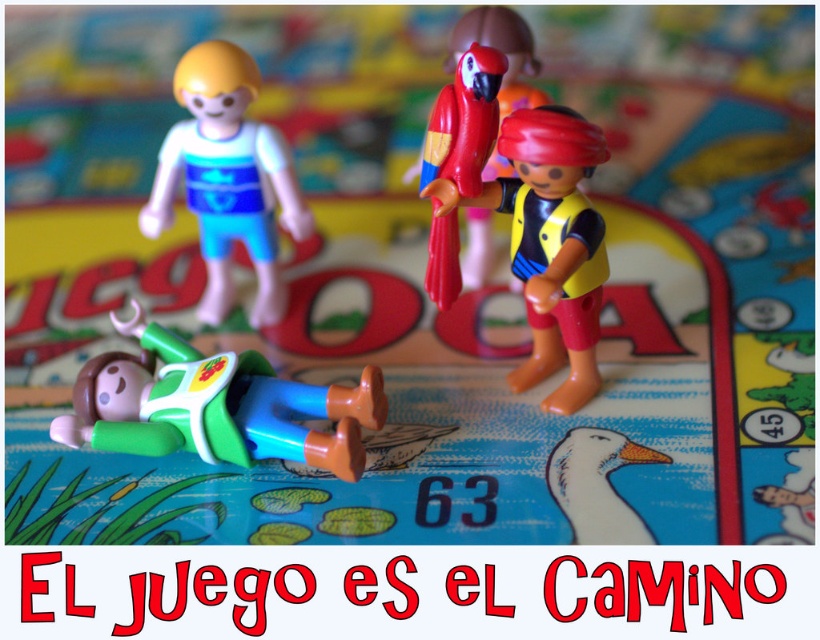
You are playing a board game and need to place the matte yellow vest at center and the white matte duck at lower center on the game board. Based on their sizes, which one should you place first to ensure they fit properly?

The matte yellow vest at center is much taller than the white matte duck at lower center. Therefore, you should place the matte yellow vest at center first to accommodate its larger size before placing the smaller white matte duck at lower center.

You are playing a board game and see the matte yellow vest at center and the white matte duck at lower center. Which object is positioned higher in the image?

The matte yellow vest at center is above the white matte duck at lower center, so it is positioned higher in the image.

You are playing a board game and need to move your pieces. You have the green matte figure at lower left and the white matte duck at lower center. Which piece is closer to you, the player?

The green matte figure at lower left is closer to you because the white matte duck at lower center is positioned behind it.